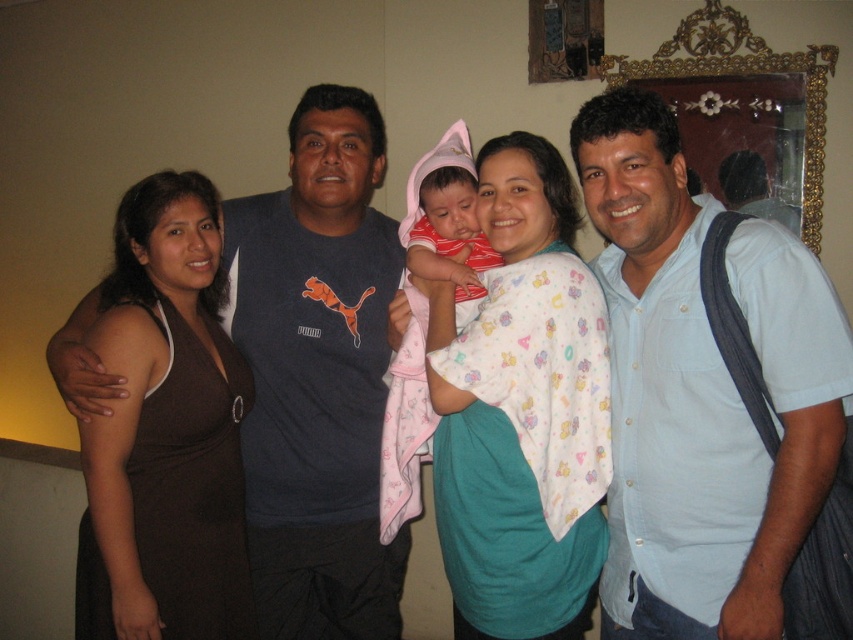
You are a photographer adjusting the camera settings for a group photo. You notice the striped cotton shirt at center and the matte pink fabric baby at center. Which object should you focus on first if you want to ensure both are in sharp focus, considering their sizes?

The striped cotton shirt at center has a larger size compared to the matte pink fabric baby at center, so you should focus on the larger object first to ensure depth of field covers both.

You are trying to determine the clothing colors of two people in the image. The light blue shirt at center and the brown dress at left are both visible. Based on their positions and sizes, which clothing item appears taller?

The light blue shirt at center appears taller because it has a greater height compared to the brown dress at left according to the description.

You are standing in the room and see the point at coordinates (521,412). Which object from the scene does this point lie on?

The point at coordinates (521,412) lies on the white cotton shirt at center.